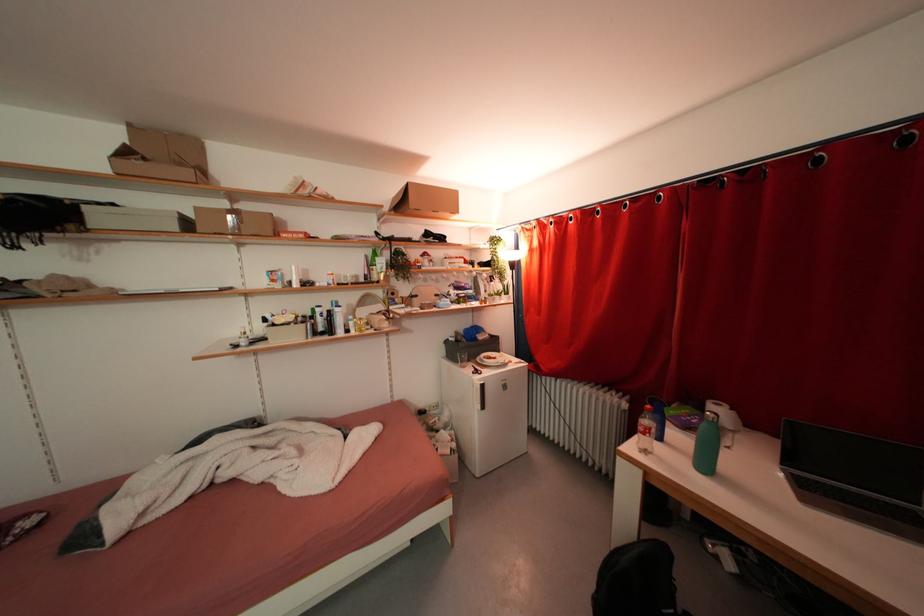
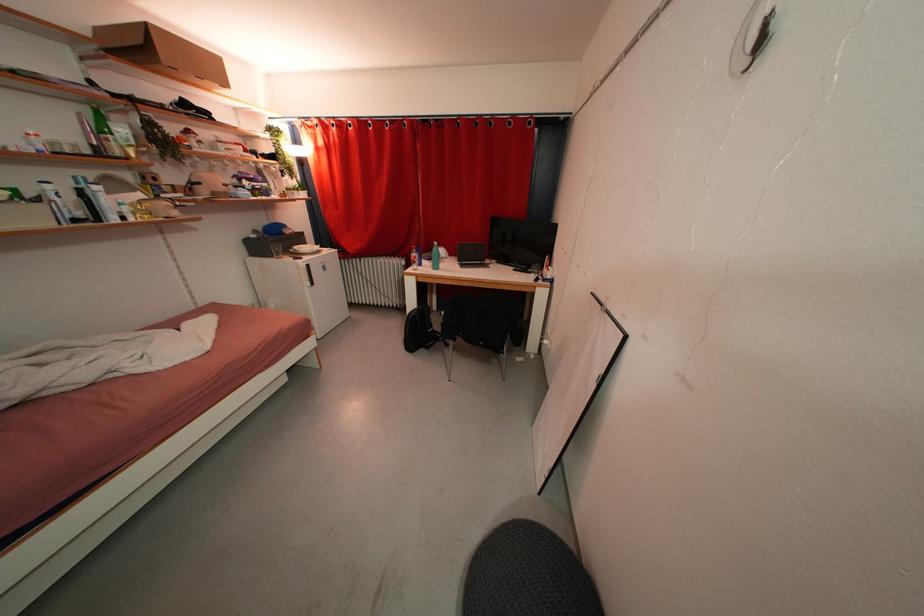
Find the pixel in the second image that matches the point at 482,379 in the first image.

(305, 265)